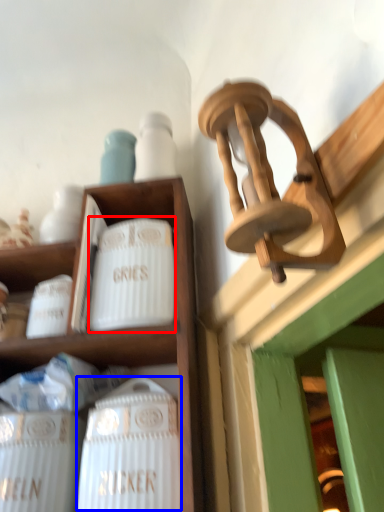
Question: Which object appears closest to the camera in this image, pottery (highlighted by a red box) or wine bottle (highlighted by a blue box)?

Choices:
 (A) pottery
 (B) wine bottle

Answer: (B)